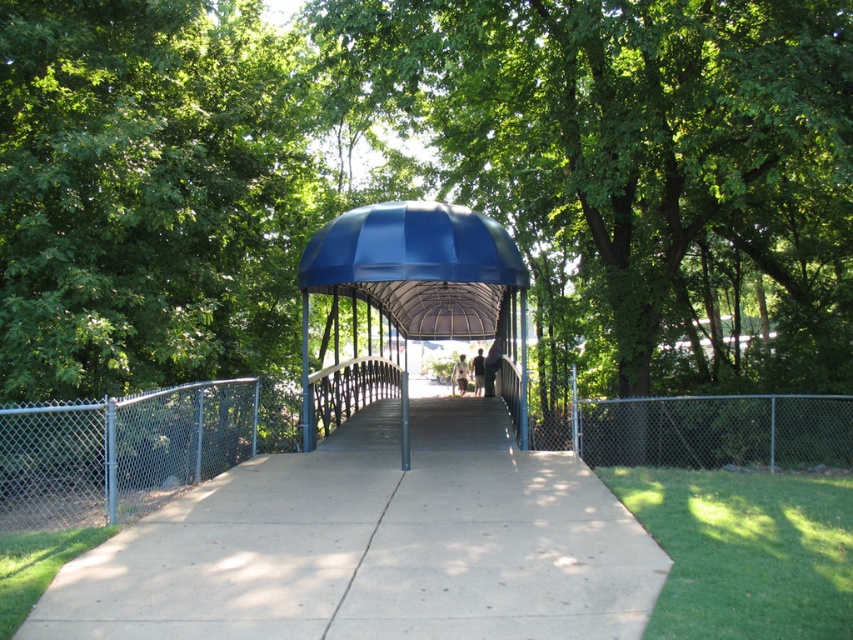
Consider the image. You are a painter standing on the walkway of the pedestrian bridge and want to paint the chain link fence at left and the dark blue fabric person at center. Which object should you focus on first if you want to paint the wider one first?

The chain link fence at left is wider than the dark blue fabric person at center, so you should focus on painting the chain link fence at left first.